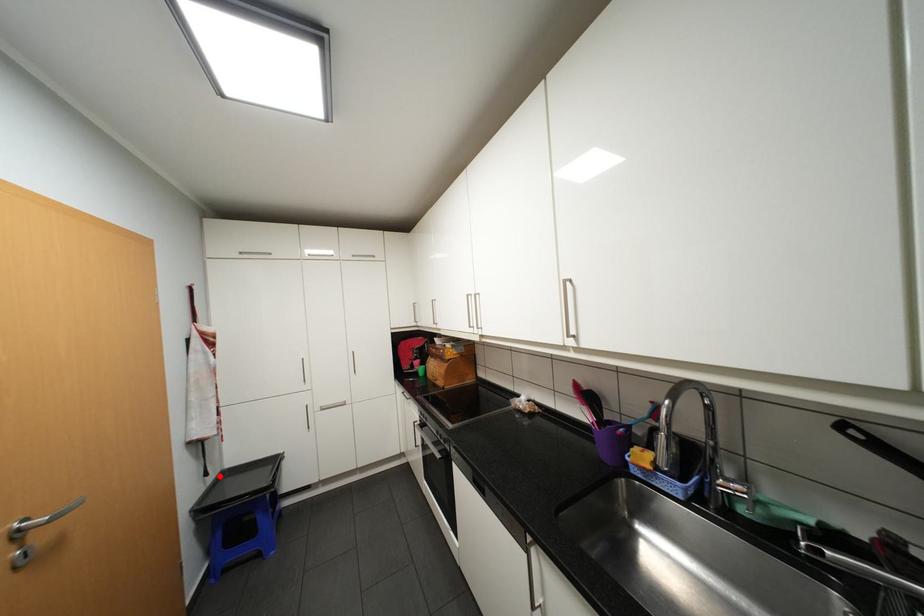
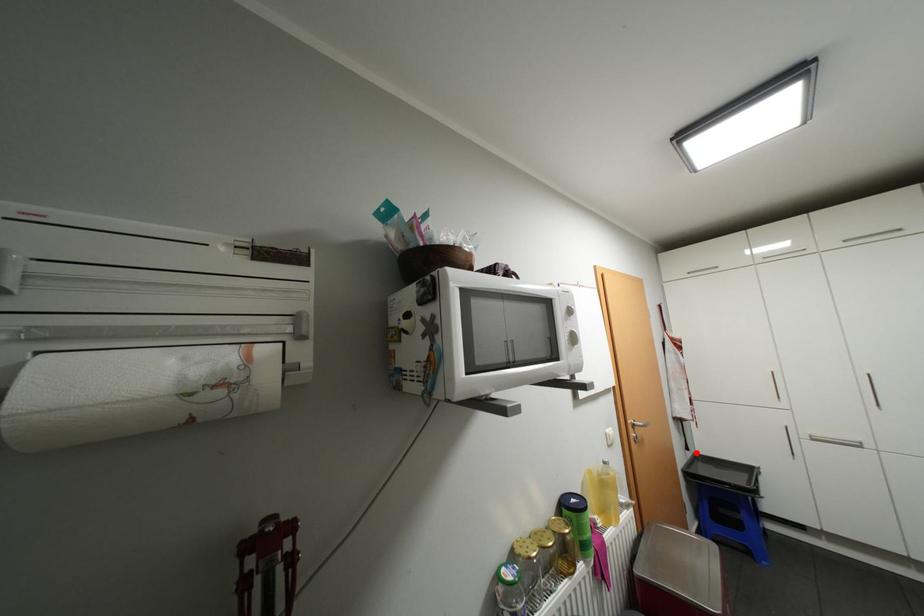
I am providing you with two images of the same scene from different viewpoints. A red point is marked on the first image and another point is marked on the second image. Are the points marked in image1 and image2 representing the same 3D position?

Yes